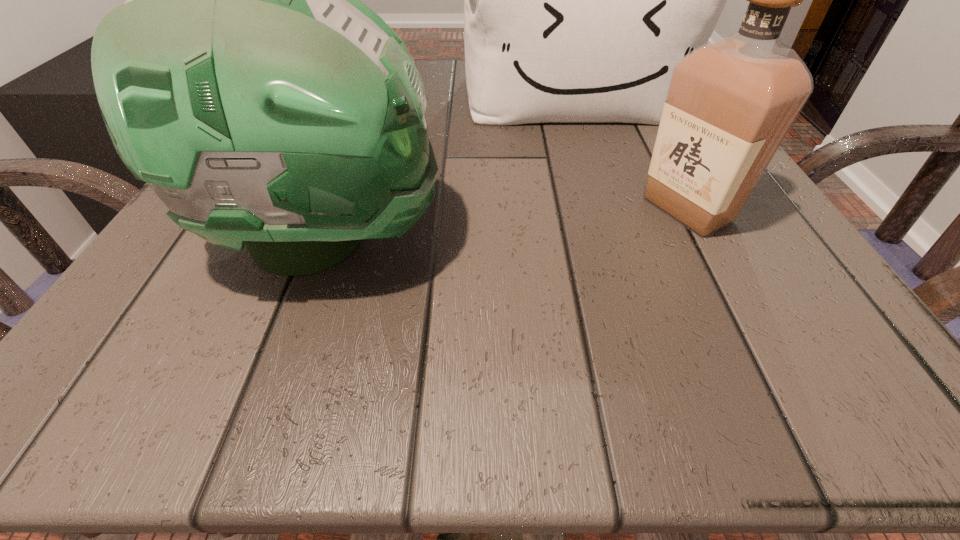
Where is `the farthest object`? This screenshot has width=960, height=540. the farthest object is located at coordinates (579, 0).

At what (x,y) coordinates should I click in order to perform the action: click on the leftmost object. Please return your answer as a coordinate pair (x, y). Looking at the image, I should click on (243, 79).

Where is `liquor`? This screenshot has height=540, width=960. liquor is located at coordinates (731, 102).

Find the location of `free space located on the side of the farthest object with the smiley face`. free space located on the side of the farthest object with the smiley face is located at coordinates (637, 285).

The height and width of the screenshot is (540, 960). I want to click on free space located on the visor of the leftmost object, so click(x=763, y=239).

The width and height of the screenshot is (960, 540). In order to click on vacant space located 0.080m on the front-facing side of the liquor in this screenshot , I will do `click(581, 210)`.

Where is `blank space located on the front-facing side of the liquor`? Image resolution: width=960 pixels, height=540 pixels. blank space located on the front-facing side of the liquor is located at coordinates (350, 210).

In order to click on vacant space located on the front-facing side of the liquor in this screenshot , I will do `click(432, 210)`.

Where is `object that is at the far edge`? Image resolution: width=960 pixels, height=540 pixels. object that is at the far edge is located at coordinates (579, 0).

Image resolution: width=960 pixels, height=540 pixels. In order to click on object that is at the left edge in this screenshot , I will do `click(243, 79)`.